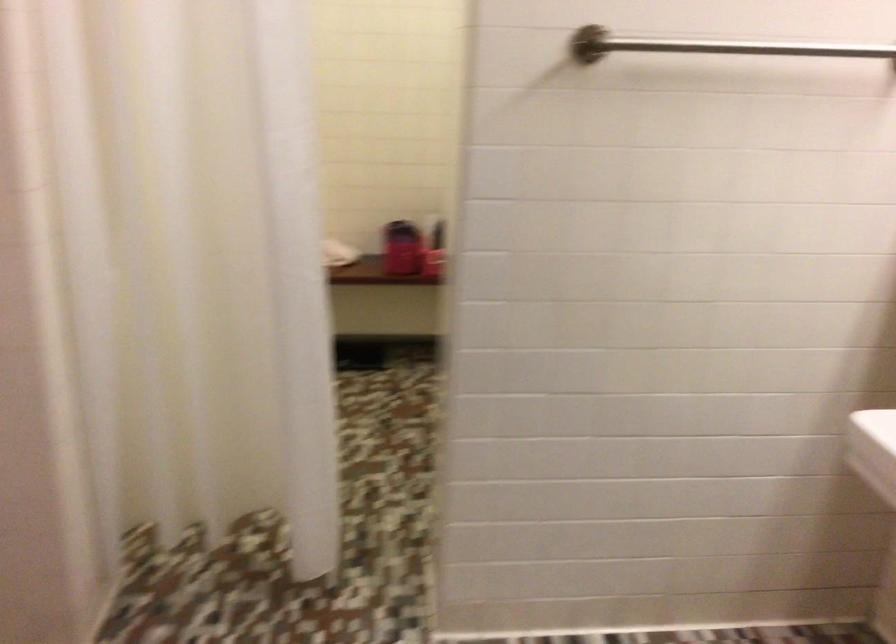
This screenshot has height=644, width=896. What do you see at coordinates (382, 301) in the screenshot?
I see `a bench sitting surface` at bounding box center [382, 301].